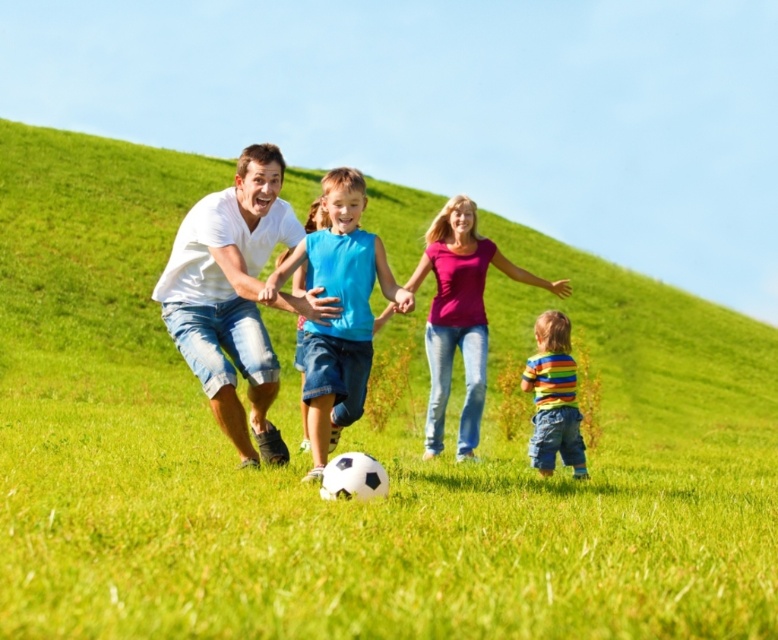
Is white matte shirt at center closer to the viewer compared to blue denim shorts at center?

That is False.

Who is lower down, white matte shirt at center or blue denim shorts at center?

Result: blue denim shorts at center

The image size is (778, 640). Describe the element at coordinates (230, 296) in the screenshot. I see `white matte shirt at center` at that location.

Locate an element on the screen. white matte shirt at center is located at coordinates (230, 296).

Describe the element at coordinates (300, 298) in the screenshot. The height and width of the screenshot is (640, 778). I see `white cotton shirt at center` at that location.

Image resolution: width=778 pixels, height=640 pixels. What do you see at coordinates (300, 298) in the screenshot?
I see `white cotton shirt at center` at bounding box center [300, 298].

Locate an element on the screen. The image size is (778, 640). white cotton shirt at center is located at coordinates (300, 298).

Does blue denim shorts at center have a smaller size compared to striped cotton shirt at lower right?

No, blue denim shorts at center is not smaller than striped cotton shirt at lower right.

The image size is (778, 640). I want to click on blue denim shorts at center, so pyautogui.click(x=342, y=310).